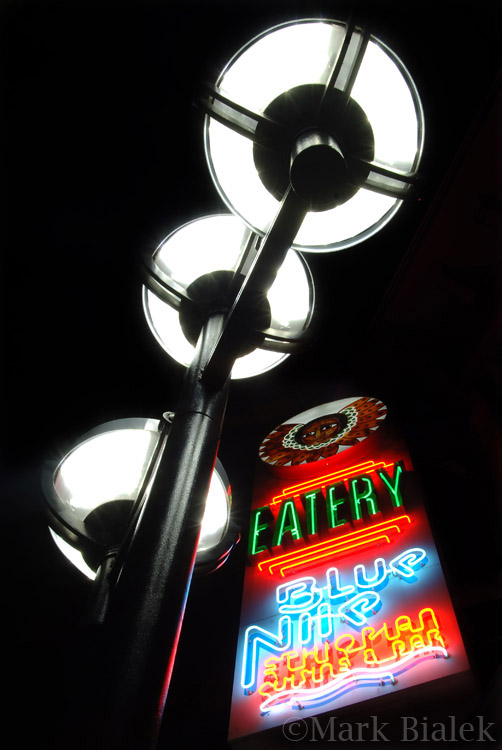
I want to click on lampshade, so click(124, 451).